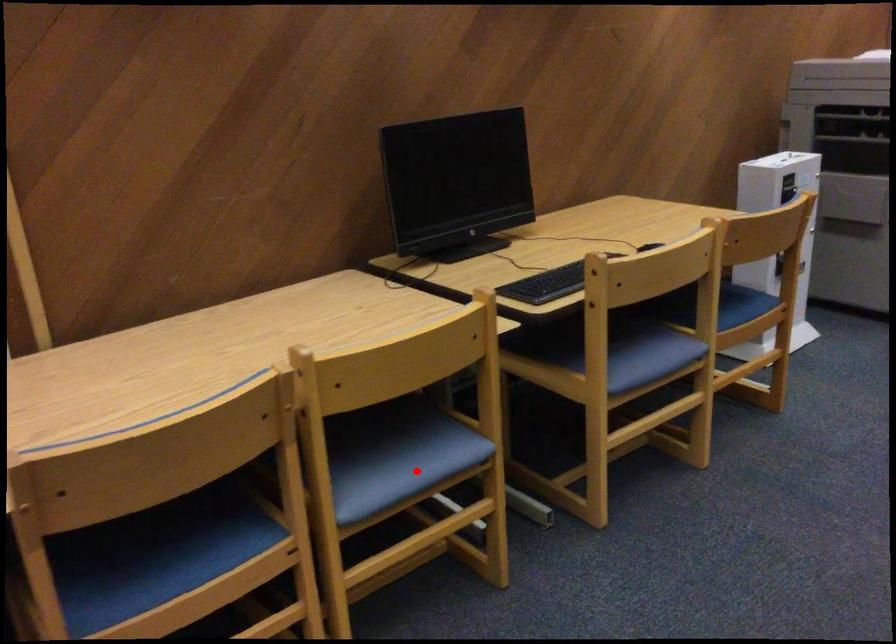
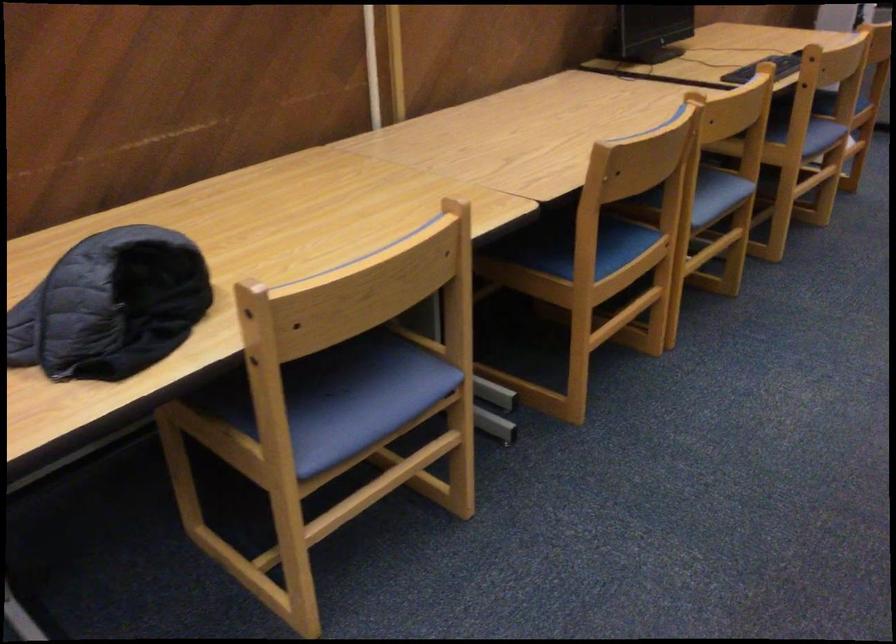
Question: I am providing you with two images of the same scene from different viewpoints. A red point is marked on the first image. Can you still see the location of the red point in image 2?

Choices:
 (A) Yes
 (B) No

Answer: (A)